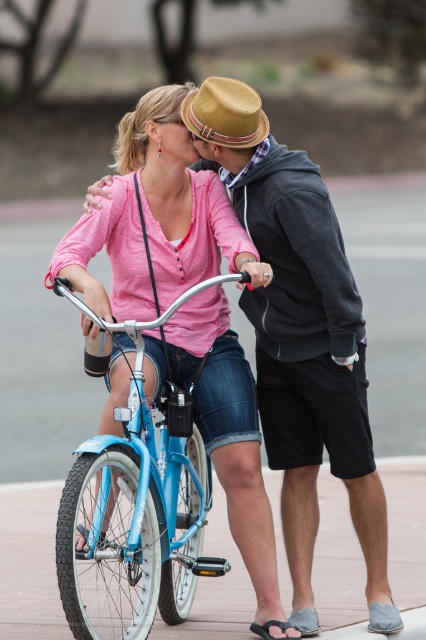
You are an artist trying to sketch this scene. You want to ensure the proportions between the matte pink shirt at center and the blue metallic bicycle at center are accurate. Which object should you draw first to maintain proper scale, and why?

You should draw the matte pink shirt at center first because it is larger than the blue metallic bicycle at center, so starting with the larger object ensures the bicycle will fit correctly in the composition.

You are a fashion designer observing the scene. You need to create a design that fits over the matte pink shirt at center and the blue metallic bicycle at center. Which object requires a larger width measurement for the design?

The matte pink shirt at center requires a larger width measurement because its width surpasses that of the blue metallic bicycle at center.